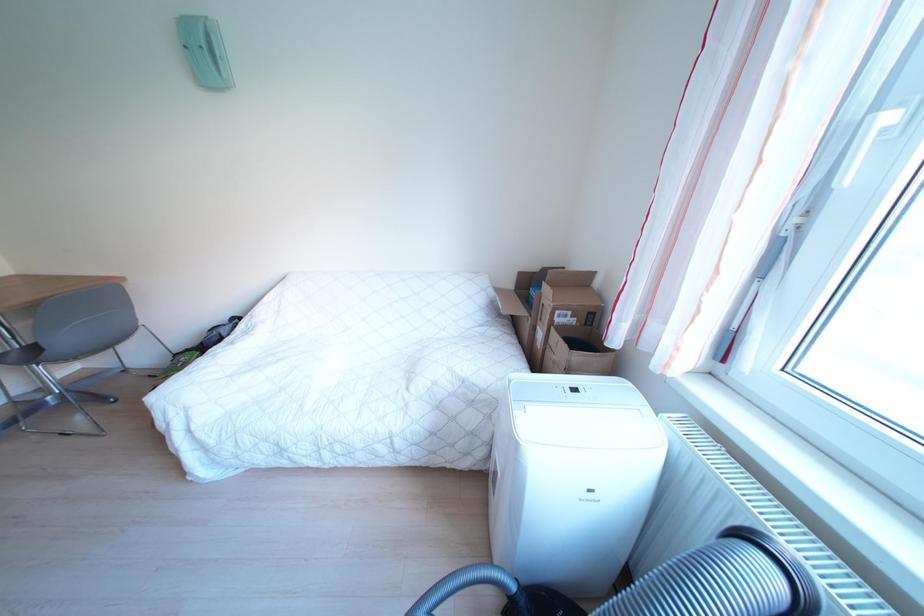
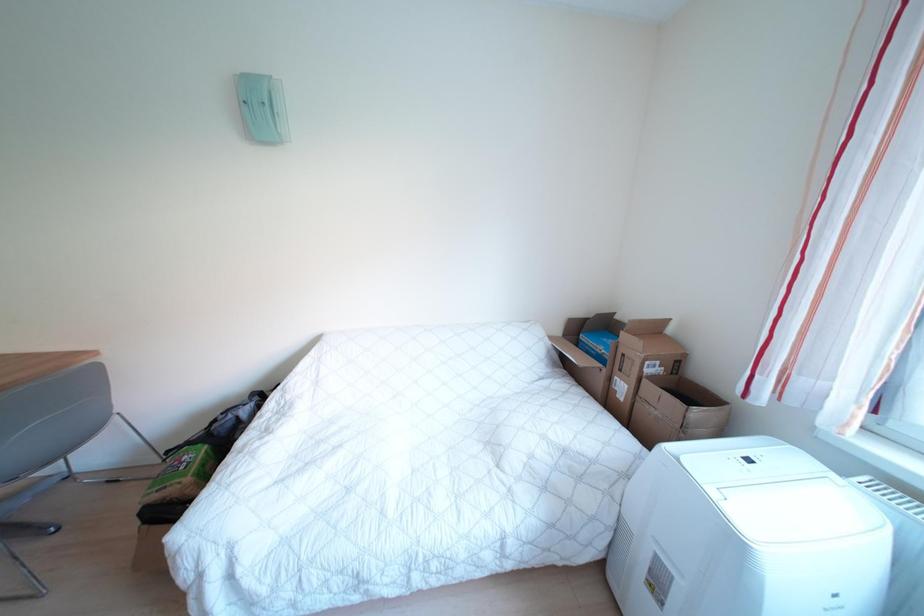
Question: The images are taken continuously from a first-person perspective. In which direction are you moving?

Choices:
 (A) Left
 (B) Right
 (C) Forward
 (D) Backward

Answer: (A)